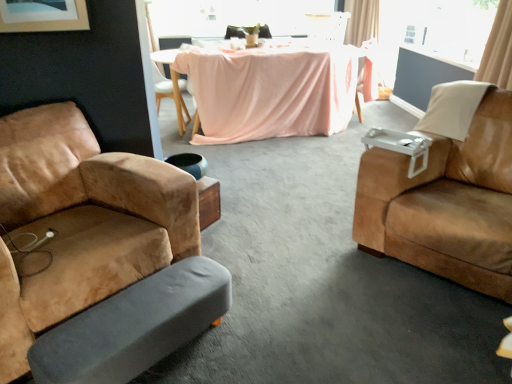
Identify the location of free point to the right of gray fabric footrest at lower left. This screenshot has width=512, height=384. (266, 337).